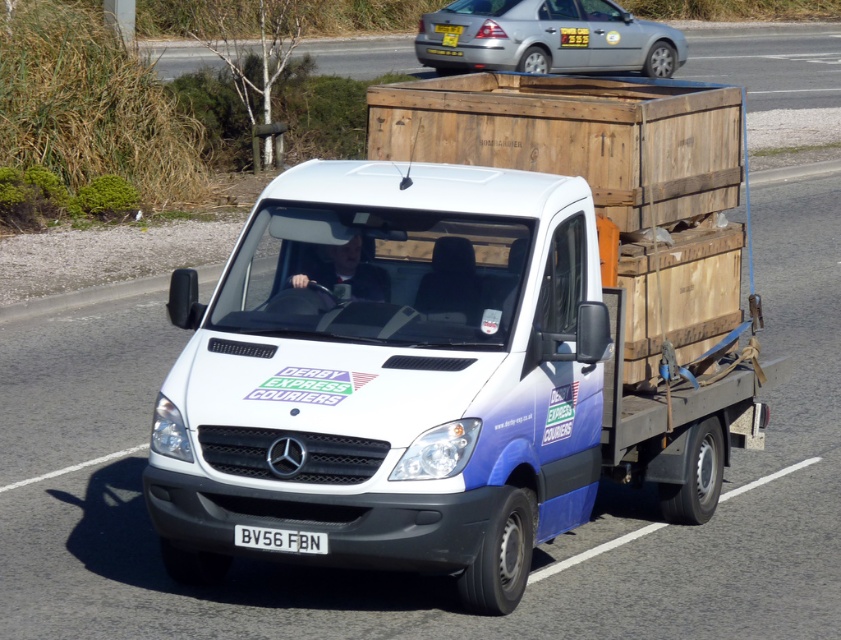
Question: Which of these objects is positioned closest to the white matte van at center?

Choices:
 (A) silver metallic sedan at upper center
 (B) white plastic license plate at center

Answer: (B)

Question: Which is nearer to the silver metallic sedan at upper center?

Choices:
 (A) white plastic license plate at center
 (B) white matte van at center

Answer: (B)

Question: Does silver metallic sedan at upper center have a lesser width compared to white plastic license plate at center?

Choices:
 (A) no
 (B) yes

Answer: (A)

Question: Considering the real-world distances, which object is farthest from the silver metallic sedan at upper center?

Choices:
 (A) white matte van at center
 (B) white plastic license plate at center

Answer: (B)

Question: Does white matte van at center appear over silver metallic sedan at upper center?

Choices:
 (A) yes
 (B) no

Answer: (B)

Question: Does silver metallic sedan at upper center appear under white plastic license plate at center?

Choices:
 (A) yes
 (B) no

Answer: (B)